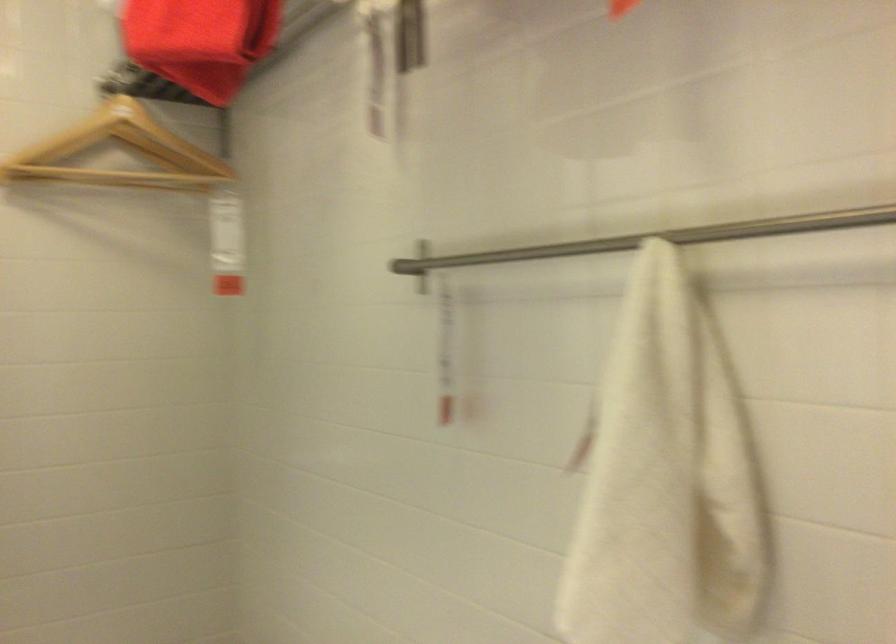
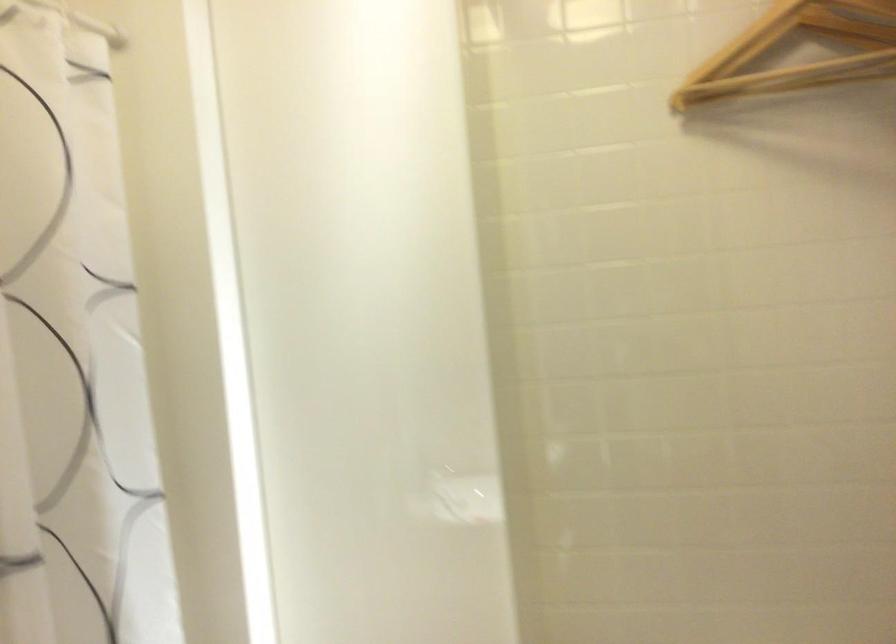
Question: The camera is either moving clockwise (left) or counter-clockwise (right) around the object. The first image is from the beginning of the video and the second image is from the end. Is the camera moving left or right when shooting the video?

Choices:
 (A) Left
 (B) Right

Answer: (B)